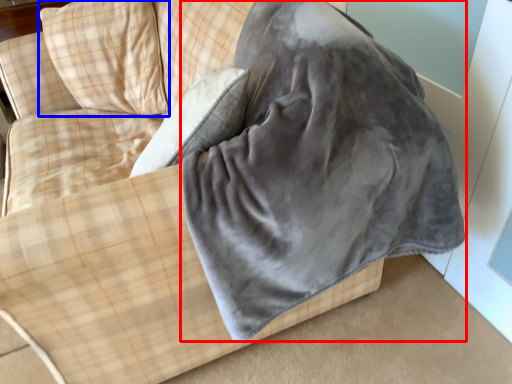
Question: Which object appears closest to the camera in this image, sleeping bag (highlighted by a red box) or pillow (highlighted by a blue box)?

Choices:
 (A) sleeping bag
 (B) pillow

Answer: (A)